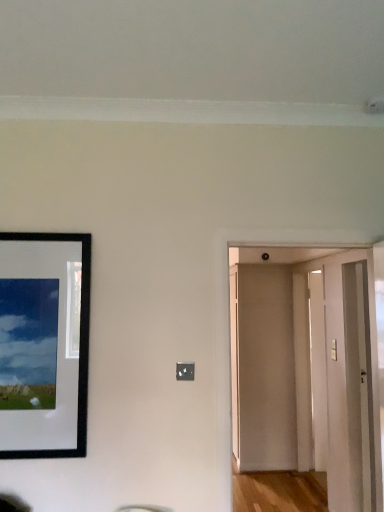
In order to face white glossy door at right, the second door from the back, should I rotate leftwards or rightwards?

You should rotate right by 16.810 degrees.

Find the location of a particular element. white glossy door at right, which appears as the 2th door when viewed from the front is located at coordinates (318, 371).

In order to click on black matte picture frame at left in this screenshot , I will do `click(44, 344)`.

What do you see at coordinates (279, 355) in the screenshot? I see `white wooden door at center, which is counted as the 1th door, starting from the front` at bounding box center [279, 355].

What do you see at coordinates (263, 367) in the screenshot? I see `beige matte door at center, marked as the 3th door in a front-to-back arrangement` at bounding box center [263, 367].

I want to click on transparent glass door at right, so click(349, 388).

Identify the location of white glossy door at right, the second door from the back. This screenshot has height=512, width=384. (318, 371).

Considering the relative sizes of white glossy door at right, the second door from the back, and white wooden door at center, the 3th door in the back-to-front sequence, in the image provided, is white glossy door at right, the second door from the back, thinner than white wooden door at center, the 3th door in the back-to-front sequence,?

→ Correct, the width of white glossy door at right, the second door from the back, is less than that of white wooden door at center, the 3th door in the back-to-front sequence.

Is white glossy door at right, which appears as the 2th door when viewed from the front, located outside white wooden door at center, the 3th door in the back-to-front sequence?

Absolutely, white glossy door at right, which appears as the 2th door when viewed from the front, is external to white wooden door at center, the 3th door in the back-to-front sequence.

Which is more to the left, white glossy door at right, which appears as the 2th door when viewed from the front, or white wooden door at center, the 3th door in the back-to-front sequence?

Result: Positioned to the left is white wooden door at center, the 3th door in the back-to-front sequence.

Is white glossy door at right, which appears as the 2th door when viewed from the front, facing towards transparent glass door at right?

Yes, white glossy door at right, which appears as the 2th door when viewed from the front, is oriented towards transparent glass door at right.

How far apart are white glossy door at right, which appears as the 2th door when viewed from the front, and transparent glass door at right?

white glossy door at right, which appears as the 2th door when viewed from the front, is 50.60 centimeters from transparent glass door at right.

Who is bigger, white glossy door at right, which appears as the 2th door when viewed from the front, or transparent glass door at right?

Bigger between the two is transparent glass door at right.

Is white glossy door at right, the second door from the back, beside transparent glass door at right?

white glossy door at right, the second door from the back, is not next to transparent glass door at right, and they're not touching.

Looking at this image, would you say transparent glass door at right is a long distance from beige matte door at center, marked as the 3th door in a front-to-back arrangement?

Yes, transparent glass door at right and beige matte door at center, marked as the 3th door in a front-to-back arrangement, are located far from each other.

From the image's perspective, which one is positioned lower, transparent glass door at right or beige matte door at center, placed as the 1th door when sorted from back to front?

beige matte door at center, placed as the 1th door when sorted from back to front, appears lower in the image.

Who is taller, transparent glass door at right or beige matte door at center, marked as the 3th door in a front-to-back arrangement?

With more height is beige matte door at center, marked as the 3th door in a front-to-back arrangement.

From the picture: Is the surface of beige matte door at center, marked as the 3th door in a front-to-back arrangement, in direct contact with transparent glass door at right?

No, beige matte door at center, marked as the 3th door in a front-to-back arrangement, is not next to transparent glass door at right.

From the image's perspective, count 1st doors downward from the transparent glass door at right and point to it. Please provide its 2D coordinates.

[(263, 367)]

Is beige matte door at center, placed as the 1th door when sorted from back to front, to the left or to the right of transparent glass door at right in the image?

In the image, beige matte door at center, placed as the 1th door when sorted from back to front, appears on the left side of transparent glass door at right.

Considering the sizes of beige matte door at center, marked as the 3th door in a front-to-back arrangement, and transparent glass door at right in the image, is beige matte door at center, marked as the 3th door in a front-to-back arrangement, bigger or smaller than transparent glass door at right?

beige matte door at center, marked as the 3th door in a front-to-back arrangement, is smaller than transparent glass door at right.

In terms of size, does white wooden door at center, the 3th door in the back-to-front sequence, appear bigger or smaller than transparent glass door at right?

Considering their sizes, white wooden door at center, the 3th door in the back-to-front sequence, takes up more space than transparent glass door at right.

Image resolution: width=384 pixels, height=512 pixels. What are the coordinates of `glass door behind the white wooden door at center, the 3th door in the back-to-front sequence` in the screenshot? It's located at (349, 388).

Based on the photo, is white wooden door at center, the 3th door in the back-to-front sequence, facing away from transparent glass door at right?

white wooden door at center, the 3th door in the back-to-front sequence, is not turned away from transparent glass door at right.

Is white wooden door at center, the 3th door in the back-to-front sequence, facing towards black matte picture frame at left?

No, white wooden door at center, the 3th door in the back-to-front sequence, is not oriented towards black matte picture frame at left.

From a real-world perspective, is white wooden door at center, which is counted as the 1th door, starting from the front, physically below black matte picture frame at left?

Indeed, from a real-world perspective, white wooden door at center, which is counted as the 1th door, starting from the front, is positioned beneath black matte picture frame at left.

Is white wooden door at center, which is counted as the 1th door, starting from the front, shorter than black matte picture frame at left?

No.

Is white wooden door at center, which is counted as the 1th door, starting from the front, with black matte picture frame at left?

No, white wooden door at center, which is counted as the 1th door, starting from the front, is not in contact with black matte picture frame at left.

From the black matte picture frame at left, count 2nd door to the right and point to it. Please provide its 2D coordinates.

[(263, 367)]

Which of these two, beige matte door at center, placed as the 1th door when sorted from back to front, or black matte picture frame at left, stands taller?

Standing taller between the two is beige matte door at center, placed as the 1th door when sorted from back to front.

Considering the relative sizes of beige matte door at center, marked as the 3th door in a front-to-back arrangement, and black matte picture frame at left in the image provided, is beige matte door at center, marked as the 3th door in a front-to-back arrangement, wider than black matte picture frame at left?

Indeed, beige matte door at center, marked as the 3th door in a front-to-back arrangement, has a greater width compared to black matte picture frame at left.

Are beige matte door at center, marked as the 3th door in a front-to-back arrangement, and black matte picture frame at left located far from each other?

beige matte door at center, marked as the 3th door in a front-to-back arrangement, is far away from black matte picture frame at left.

The width and height of the screenshot is (384, 512). What are the coordinates of `door that is the 2nd object located above the white glossy door at right, the second door from the back (from the image's perspective)` in the screenshot? It's located at (279, 355).

I want to click on glass door located in front of the white glossy door at right, the second door from the back, so click(x=349, y=388).

Based on their spatial positions, is beige matte door at center, marked as the 3th door in a front-to-back arrangement, or black matte picture frame at left further from transparent glass door at right?

black matte picture frame at left.

Considering their positions, is white wooden door at center, which is counted as the 1th door, starting from the front, positioned further to transparent glass door at right than beige matte door at center, placed as the 1th door when sorted from back to front?

beige matte door at center, placed as the 1th door when sorted from back to front, lies further to transparent glass door at right than the other object.

When comparing their distances from black matte picture frame at left, does white wooden door at center, the 3th door in the back-to-front sequence, or white glossy door at right, the second door from the back, seem closer?

white wooden door at center, the 3th door in the back-to-front sequence.

Which object lies further to the anchor point transparent glass door at right, white wooden door at center, the 3th door in the back-to-front sequence, or white glossy door at right, which appears as the 2th door when viewed from the front?

white wooden door at center, the 3th door in the back-to-front sequence, is further to transparent glass door at right.

When comparing their distances from transparent glass door at right, does black matte picture frame at left or white wooden door at center, which is counted as the 1th door, starting from the front, seem further?

black matte picture frame at left is further to transparent glass door at right.

Looking at the image, which one is located further to black matte picture frame at left, beige matte door at center, marked as the 3th door in a front-to-back arrangement, or white wooden door at center, which is counted as the 1th door, starting from the front?

Among the two, beige matte door at center, marked as the 3th door in a front-to-back arrangement, is located further to black matte picture frame at left.

From the image, which object appears to be nearer to white wooden door at center, the 3th door in the back-to-front sequence, beige matte door at center, placed as the 1th door when sorted from back to front, or transparent glass door at right?

beige matte door at center, placed as the 1th door when sorted from back to front, is closer to white wooden door at center, the 3th door in the back-to-front sequence.

When comparing their distances from white wooden door at center, the 3th door in the back-to-front sequence, does black matte picture frame at left or beige matte door at center, placed as the 1th door when sorted from back to front, seem further?

black matte picture frame at left.

Find the location of a particular element. The image size is (384, 512). door between transparent glass door at right and beige matte door at center, marked as the 3th door in a front-to-back arrangement, in the front-back direction is located at coordinates (318, 371).

Locate an element on the screen. The image size is (384, 512). glass door located between black matte picture frame at left and white glossy door at right, which appears as the 2th door when viewed from the front, in the depth direction is located at coordinates coord(349,388).

Locate an element on the screen. glass door positioned between white wooden door at center, the 3th door in the back-to-front sequence, and beige matte door at center, placed as the 1th door when sorted from back to front, from near to far is located at coordinates (349, 388).

Where is `glass door between black matte picture frame at left and beige matte door at center, placed as the 1th door when sorted from back to front, in the front-back direction`? This screenshot has width=384, height=512. glass door between black matte picture frame at left and beige matte door at center, placed as the 1th door when sorted from back to front, in the front-back direction is located at coordinates (349, 388).